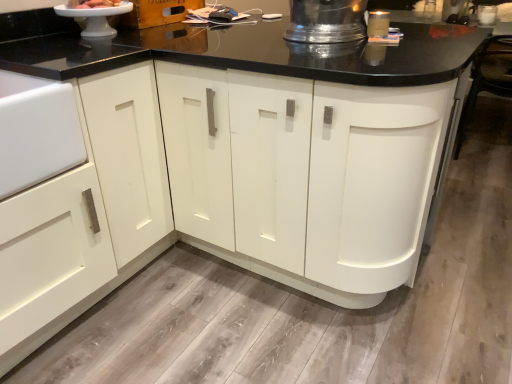
Question: Visually, is shiny metallic pitcher at upper center, the 2th appliance in the left-to-right sequence, positioned to the left or to the right of white glossy cake at upper left?

Choices:
 (A) right
 (B) left

Answer: (A)

Question: Is shiny metallic pitcher at upper center, the 2th appliance in the left-to-right sequence, in front of or behind white glossy cake at upper left in the image?

Choices:
 (A) behind
 (B) front

Answer: (B)

Question: Estimate the real-world distances between objects in this image. Which object is farther from the shiny metallic pitcher at upper center, placed as the 1th appliance when sorted from right to left?

Choices:
 (A) white glossy cake stand at upper left, placed as the 1th appliance when sorted from left to right
 (B) white glossy cake at upper left

Answer: (B)

Question: Which of these objects is positioned closest to the white glossy cake at upper left?

Choices:
 (A) shiny metallic pitcher at upper center, the 2th appliance in the left-to-right sequence
 (B) white glossy cake stand at upper left, placed as the 1th appliance when sorted from left to right

Answer: (B)